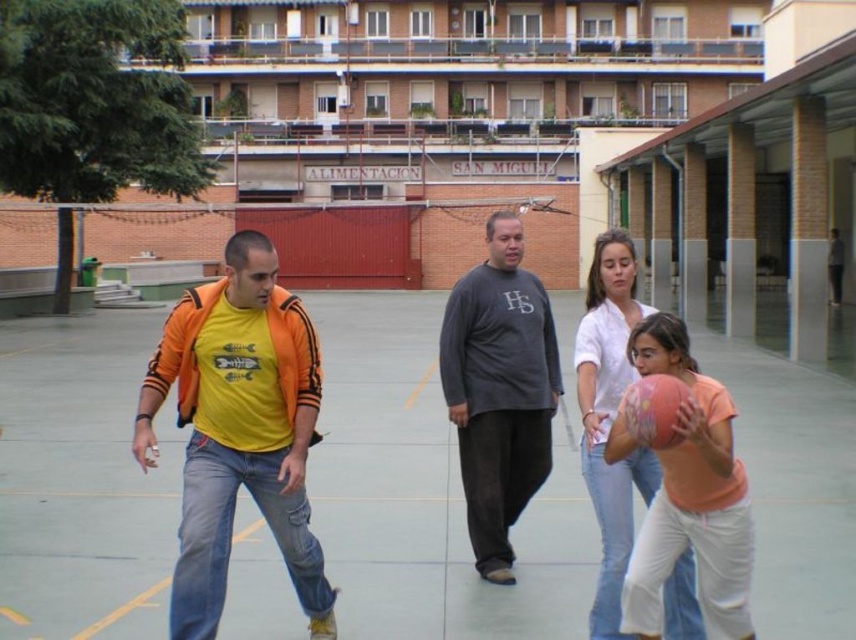
Is white cotton shirt at center shorter than multicolored rubber basketball at center?

Incorrect, white cotton shirt at center's height does not fall short of multicolored rubber basketball at center's.

Does white cotton shirt at center have a lesser width compared to multicolored rubber basketball at center?

In fact, white cotton shirt at center might be wider than multicolored rubber basketball at center.

The image size is (856, 640). What are the coordinates of `white cotton shirt at center` in the screenshot? It's located at (610, 417).

Can you confirm if gray cotton shirt at center is bigger than white cotton shirt at center?

No.

Who is lower down, gray cotton shirt at center or white cotton shirt at center?

gray cotton shirt at center is lower down.

Between point (479, 316) and point (634, 314), which one is positioned behind?

The point (479, 316) is more distant.

I want to click on gray cotton shirt at center, so click(x=498, y=390).

What are the coordinates of `rubber basketball at center` in the screenshot? It's located at (428, 492).

Consider the image. Can you confirm if rubber basketball at center is shorter than matte yellow t-shirt at center?

In fact, rubber basketball at center may be taller than matte yellow t-shirt at center.

Between point (82, 433) and point (287, 440), which one is positioned in front?

Positioned in front is point (287, 440).

Identify the location of rubber basketball at center. (428, 492).